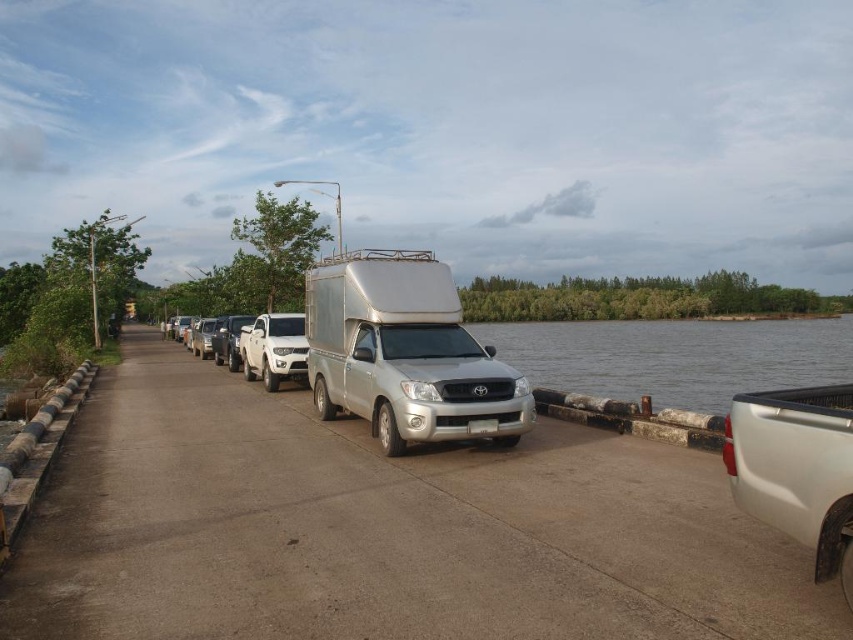
Question: Is the position of silver metallic van at center less distant than that of gray water at right?

Choices:
 (A) no
 (B) yes

Answer: (B)

Question: Considering the real-world distances, which object is farthest from the satin white sedan at center?

Choices:
 (A) silver metallic van at center
 (B) gray water at right
 (C) satin silver sedan at center

Answer: (B)

Question: Which of the following is the farthest from the observer?

Choices:
 (A) (201, 321)
 (B) (247, 353)
 (C) (640, 348)

Answer: (C)

Question: Can you confirm if white matte truck at center is positioned below satin white sedan at center?

Choices:
 (A) no
 (B) yes

Answer: (B)

Question: Which object appears closest to the camera in this image?

Choices:
 (A) silver metallic van at center
 (B) satin silver sedan at center

Answer: (A)

Question: Observing the image, what is the correct spatial positioning of silver metallic van at center in reference to satin silver sedan at center?

Choices:
 (A) above
 (B) below

Answer: (A)